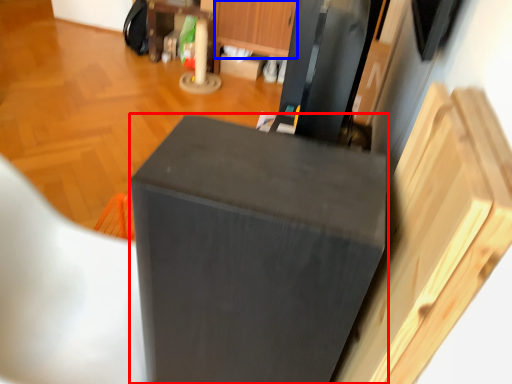
Question: Among these objects, which one is nearest to the camera, furniture (highlighted by a red box) or drawer (highlighted by a blue box)?

Choices:
 (A) furniture
 (B) drawer

Answer: (A)